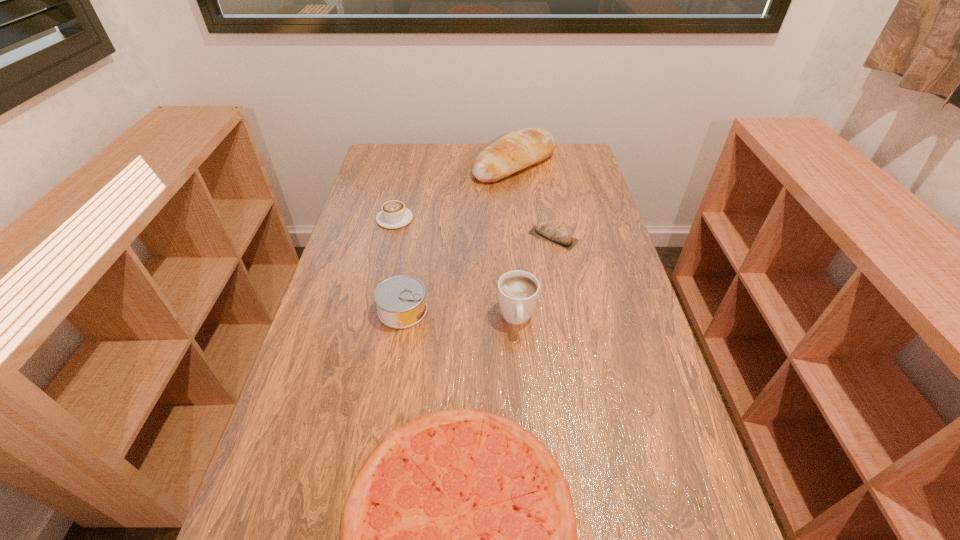
Image resolution: width=960 pixels, height=540 pixels. In the image, there is a desktop. In order to click on vacant region at the left edge in this screenshot , I will do `click(354, 220)`.

Where is `vacant space at the right edge of the desktop`? Image resolution: width=960 pixels, height=540 pixels. vacant space at the right edge of the desktop is located at coordinates (609, 442).

Locate an element on the screen. The width and height of the screenshot is (960, 540). vacant space at the far right corner of the desktop is located at coordinates (588, 167).

Identify the location of vacant space that's between the farthest object and the fifth tallest object. The image size is (960, 540). (534, 200).

Locate an element on the screen. This screenshot has width=960, height=540. empty location between the farthest object and the right cappuccino is located at coordinates coord(516,241).

Locate an element on the screen. empty space between the third tallest object and the pita bread is located at coordinates (478, 273).

The image size is (960, 540). Find the location of `vacant point located between the nearer cappuccino and the shorter cappuccino`. vacant point located between the nearer cappuccino and the shorter cappuccino is located at coordinates (456, 268).

You are a GUI agent. You are given a task and a screenshot of the screen. Output one action in this format:
    pyautogui.click(x=<x>, y=<y>)
    Task: Click on the free space between the bread and the fifth tallest object
    This screenshot has width=960, height=540.
    Given the screenshot: What is the action you would take?
    pyautogui.click(x=534, y=200)

The image size is (960, 540). I want to click on vacant area that lies between the farthest object and the farther cappuccino, so click(x=454, y=192).

Identify the location of free space between the taller cappuccino and the third shortest object. This screenshot has height=540, width=960. (456, 268).